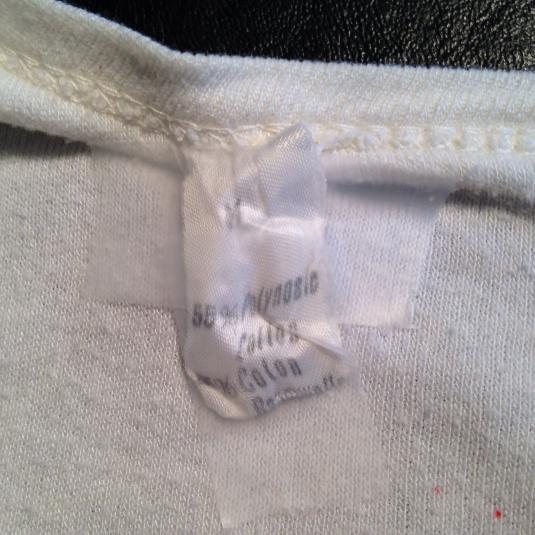
Find the location of `surface`. surface is located at coordinates (322, 36).